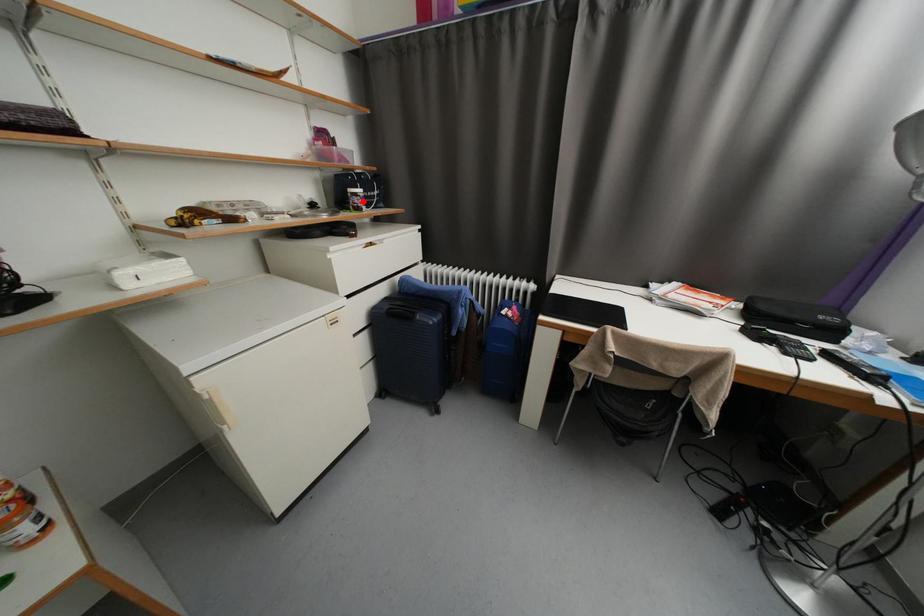
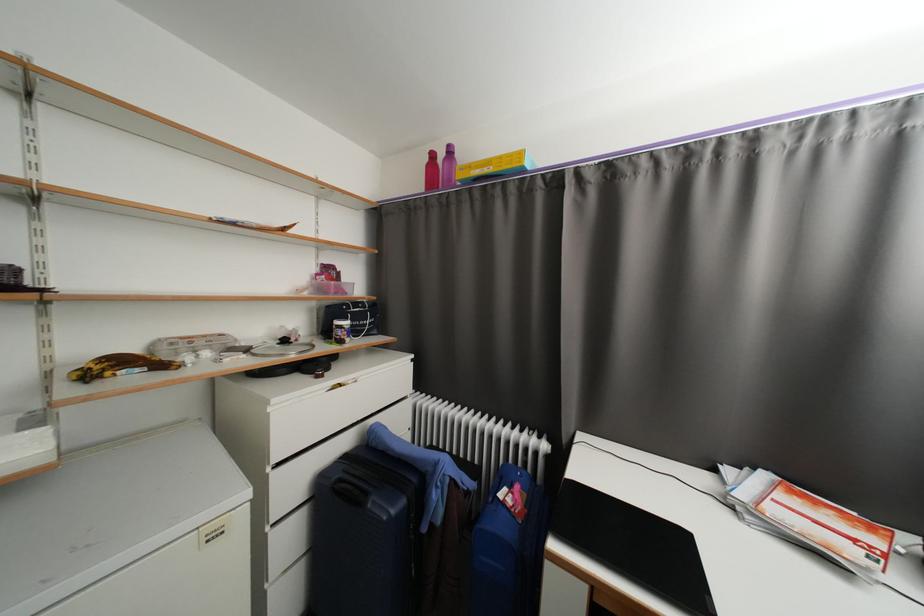
Find the pixel in the second image that matches the highlighted location in the first image.

(346, 334)